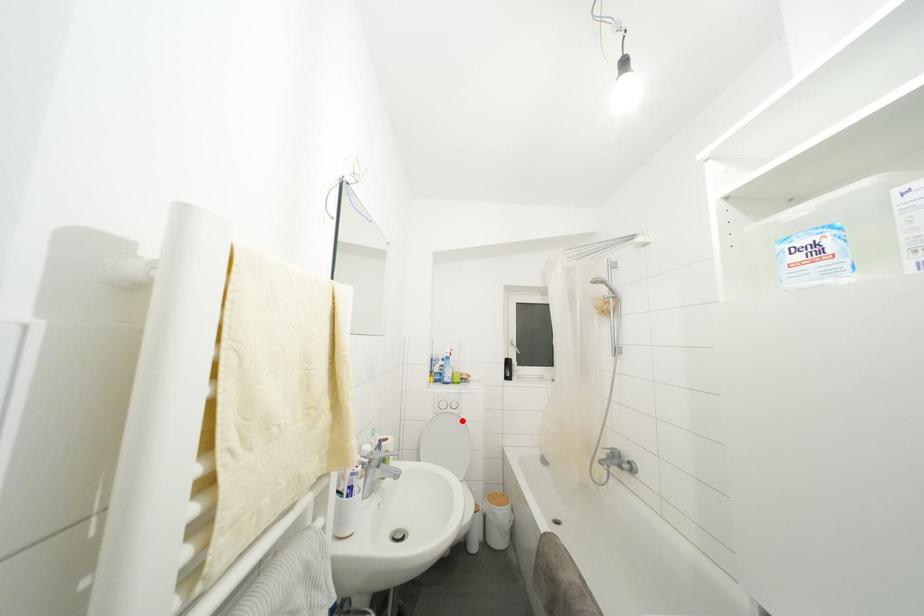
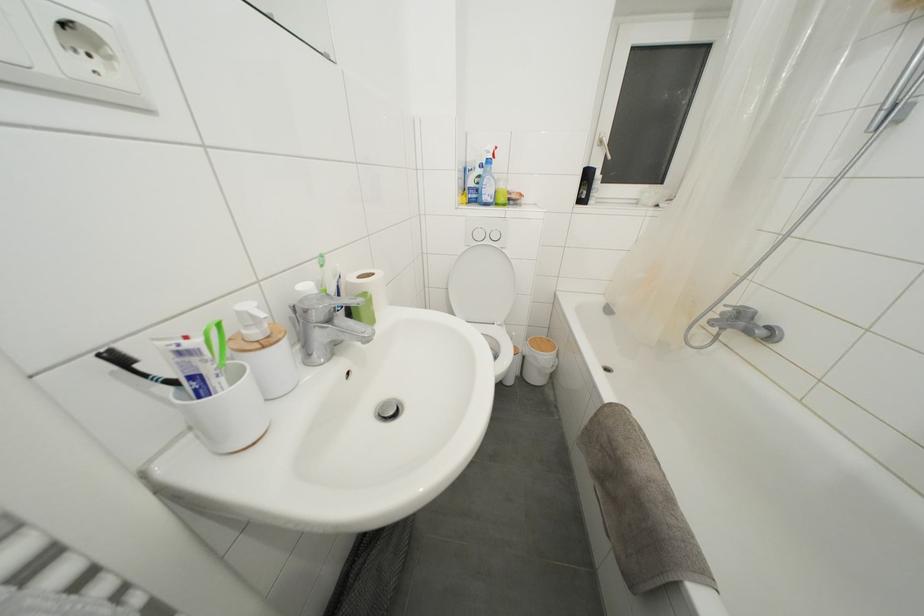
Question: A red point is marked in image1. In image2, is the corresponding 3D point closer to the camera or farther? Reply with the corresponding letter.

Choices:
 (A) The corresponding 3D point is closer.
 (B) The corresponding 3D point is farther.

Answer: (A)